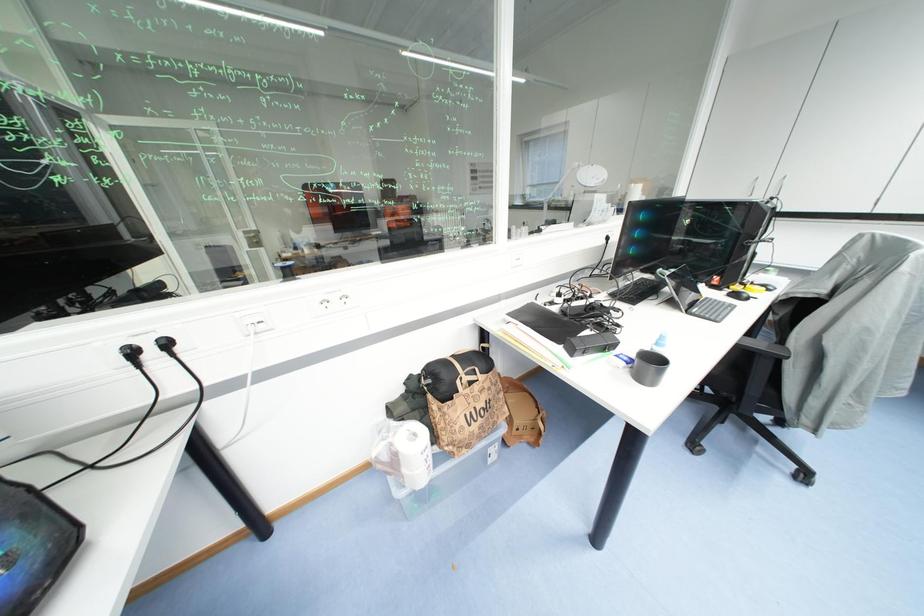
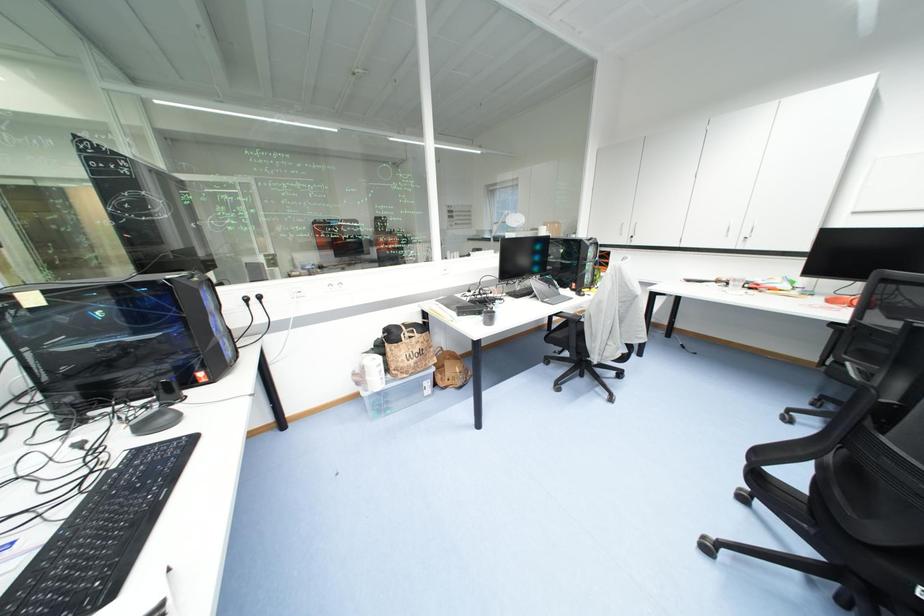
Question: The first image is from the beginning of the video and the second image is from the end. How did the camera likely rotate when shooting the video?

Choices:
 (A) Left
 (B) Right
 (C) Up
 (D) Down

Answer: (C)